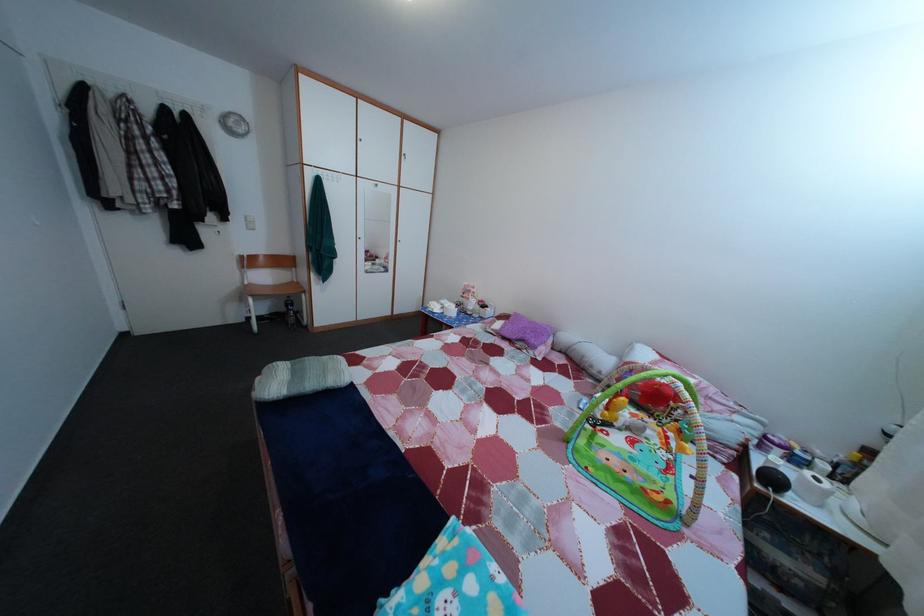
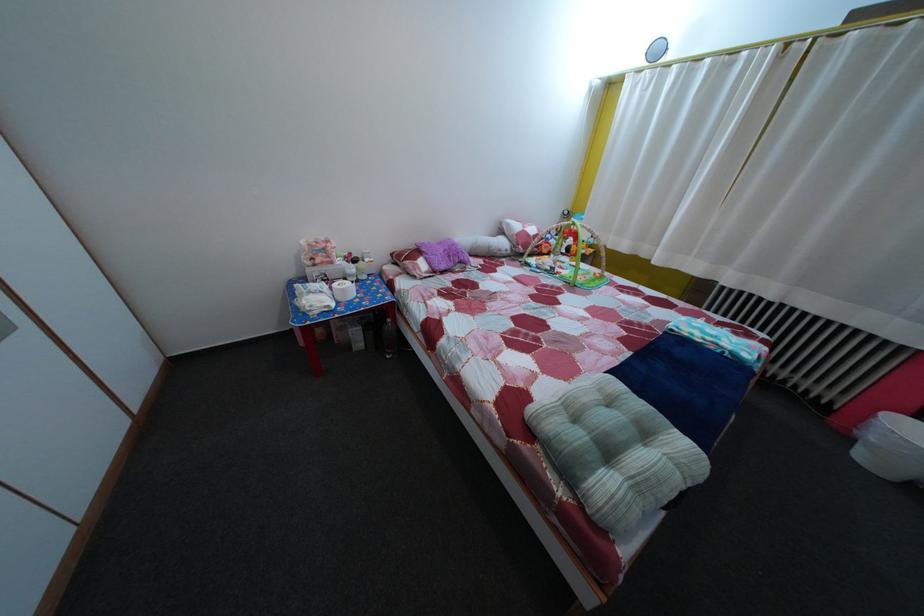
Locate, in the second image, the point that corresponds to point (541, 330) in the first image.

(450, 252)